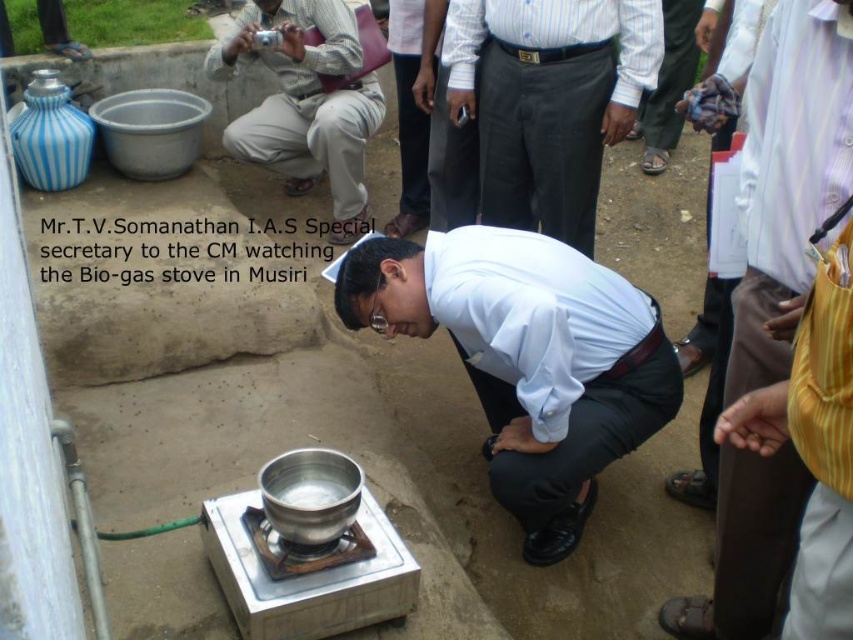
You are standing in the outdoor area where the bio gas stove demonstration is happening. You see a point marked at coordinates (x=527, y=358). What object is located at that point?

The point at coordinates (x=527, y=358) corresponds to the shiny metallic pot at center.